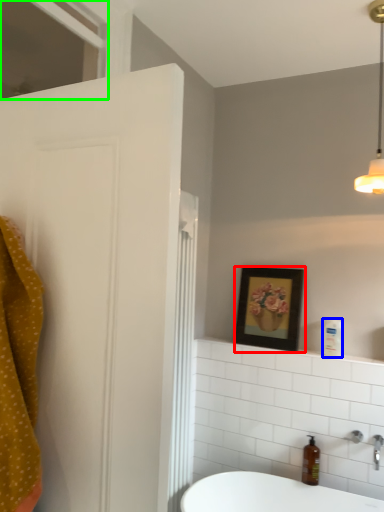
Question: Estimate the real-world distances between objects in this image. Which object is closer to picture frame (highlighted by a red box), toiletry (highlighted by a blue box) or window (highlighted by a green box)?

Choices:
 (A) toiletry
 (B) window

Answer: (A)